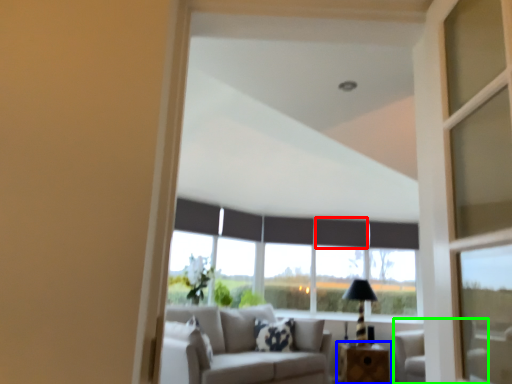
Question: Which object is positioned farthest from curtain (highlighted by a red box)? Select from table (highlighted by a blue box) and armchair (highlighted by a green box).

Choices:
 (A) table
 (B) armchair

Answer: (A)